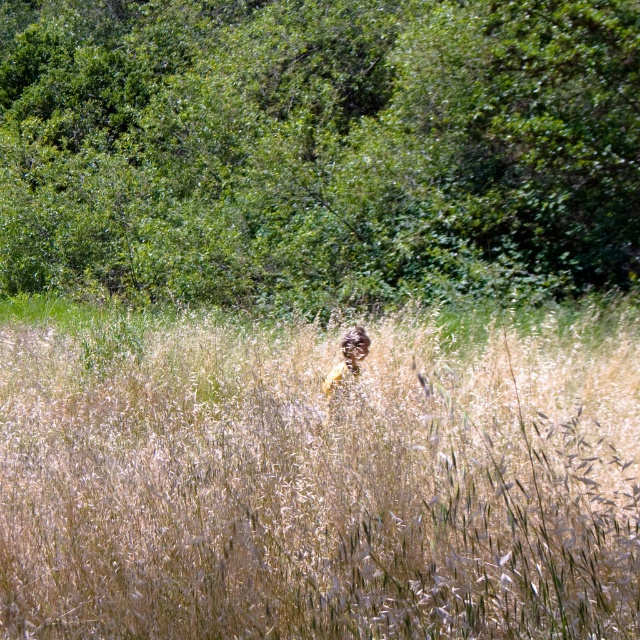
Which is behind, point (179, 29) or point (348, 337)?

Positioned behind is point (179, 29).

Locate an element on the screen. This screenshot has height=640, width=640. green leafy tree at upper center is located at coordinates click(317, 147).

Between point (384, 577) and point (330, 387), which one is positioned behind?

Point (330, 387)

Can you confirm if dry grass at center is positioned to the right of brown textured jacket at center?

Incorrect, dry grass at center is not on the right side of brown textured jacket at center.

Locate an element on the screen. dry grass at center is located at coordinates (317, 474).

Is dry grass at center taller than green leafy tree at upper center?

In fact, dry grass at center may be shorter than green leafy tree at upper center.

Does dry grass at center have a lesser width compared to green leafy tree at upper center?

Indeed, dry grass at center has a lesser width compared to green leafy tree at upper center.

Who is more distant from viewer, [166,476] or [216,36]?

The point [216,36] is behind.

In order to click on dry grass at center in this screenshot , I will do `click(317, 474)`.